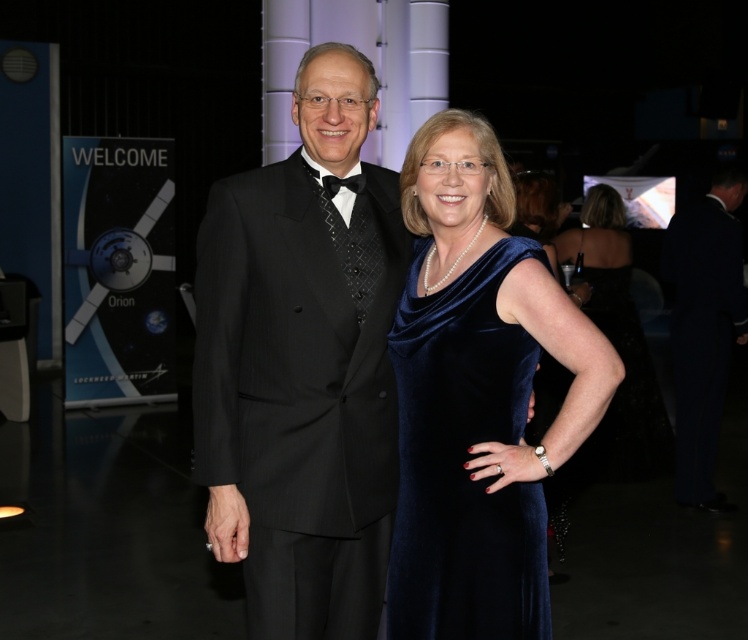
Question: Can you confirm if matte black tuxedo at center is thinner than velvet blue dress at center?

Choices:
 (A) yes
 (B) no

Answer: (A)

Question: Based on their relative distances, which object is nearer to the velvet blue dress at center?

Choices:
 (A) matte black tuxedo at center
 (B) velvet blue dress at right

Answer: (A)

Question: Among these objects, which one is nearest to the camera?

Choices:
 (A) velvet blue dress at right
 (B) velvet blue dress at center

Answer: (A)

Question: Is matte black tuxedo at center wider than black velvet suit at right?

Choices:
 (A) yes
 (B) no

Answer: (A)

Question: Among these points, which one is nearest to the camera?

Choices:
 (A) (583, 280)
 (B) (275, 518)

Answer: (B)

Question: Can you confirm if black velvet suit at right is bigger than velvet blue dress at center?

Choices:
 (A) no
 (B) yes

Answer: (A)